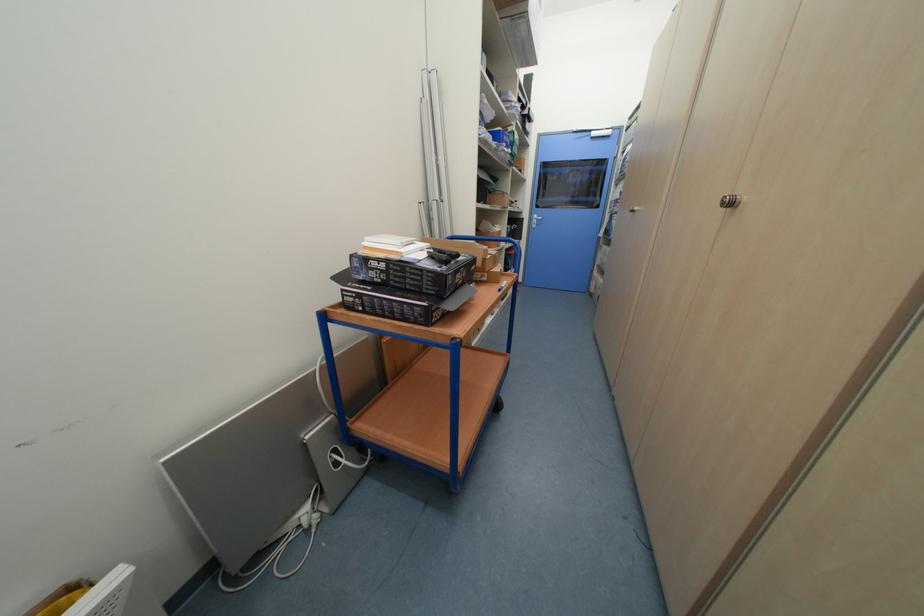
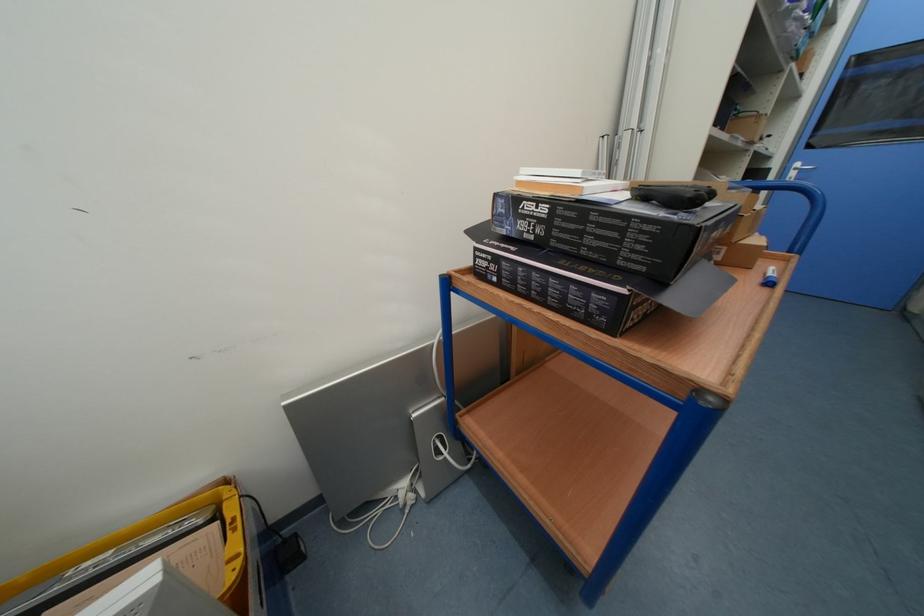
Locate, in the second image, the point that corresponds to the point at 541,217 in the first image.

(804, 166)